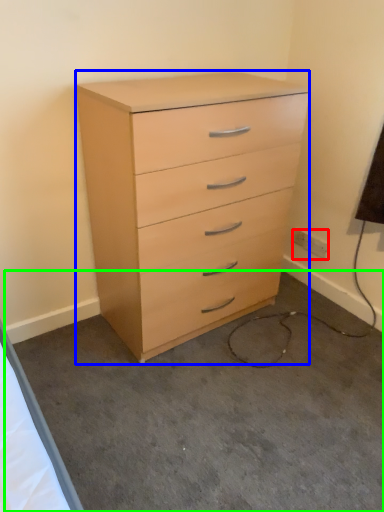
Question: Based on their relative distances, which object is nearer to electric outlet (highlighted by a red box)? Choose from chest of drawers (highlighted by a blue box) and concrete (highlighted by a green box).

Choices:
 (A) chest of drawers
 (B) concrete

Answer: (A)